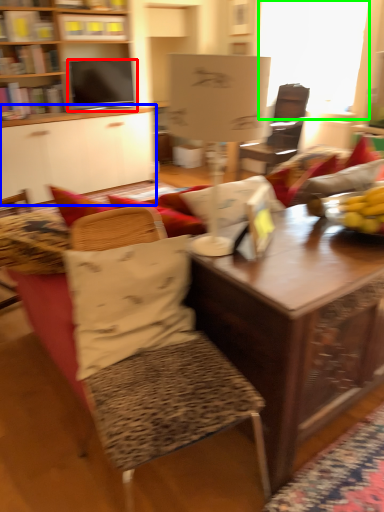
Question: Considering the real-world distances, which object is closest to television (highlighted by a red box)? desk (highlighted by a blue box) or window screen (highlighted by a green box).

Choices:
 (A) desk
 (B) window screen

Answer: (A)